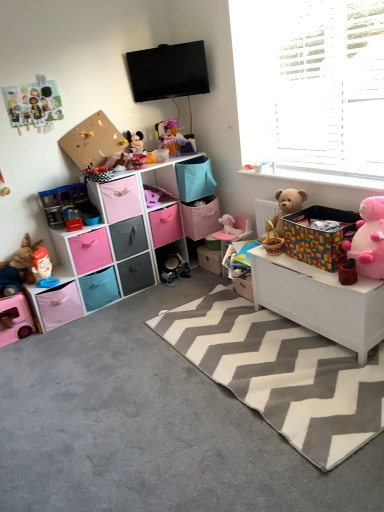
The height and width of the screenshot is (512, 384). In order to click on free spot to the right of pink fabric storage box at lower left, which is the 4th storage box from right to left in this screenshot , I will do `click(100, 322)`.